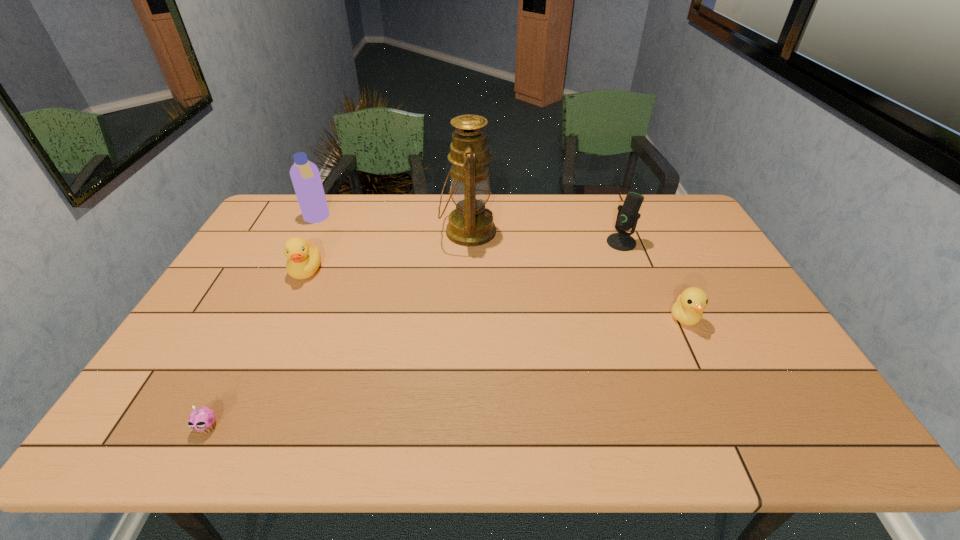
Identify the location of cupcake present at the left edge. (202, 419).

Locate an element on the screen. The height and width of the screenshot is (540, 960). object located at the far left corner is located at coordinates (305, 176).

Where is `object that is positioned at the near left corner`? object that is positioned at the near left corner is located at coordinates (202, 419).

Locate an element on the screen. free space at the far edge is located at coordinates click(623, 201).

In the image, there is a desktop. Where is `vacant space at the near edge`? Image resolution: width=960 pixels, height=540 pixels. vacant space at the near edge is located at coordinates (658, 410).

In the image, there is a desktop. Identify the location of blank space at the left edge. (217, 356).

Image resolution: width=960 pixels, height=540 pixels. In order to click on free spot at the right edge of the desktop in this screenshot , I will do `click(690, 234)`.

At what (x,y) coordinates should I click in order to perform the action: click on free space that is in between the oil lamp and the shampoo. Please return your answer as a coordinate pair (x, y). This screenshot has height=540, width=960. Looking at the image, I should click on (393, 225).

Find the location of a particular element. This screenshot has height=540, width=960. vacant area that lies between the fourth farthest object and the fourth object from left to right is located at coordinates (387, 251).

Find the location of a particular element. vacant area that lies between the third object from right to left and the farther duck is located at coordinates (387, 251).